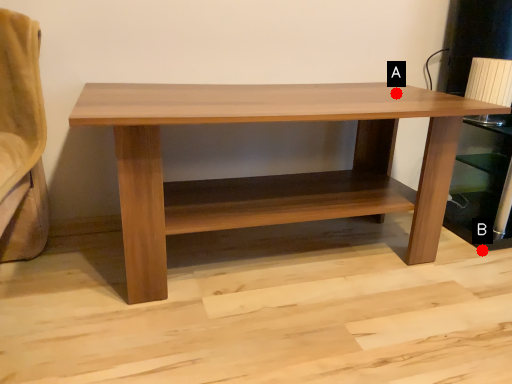
Question: Two points are circled on the image, labeled by A and B beside each circle. Which point is closer to the camera taking this photo?

Choices:
 (A) A is closer
 (B) B is closer

Answer: (A)